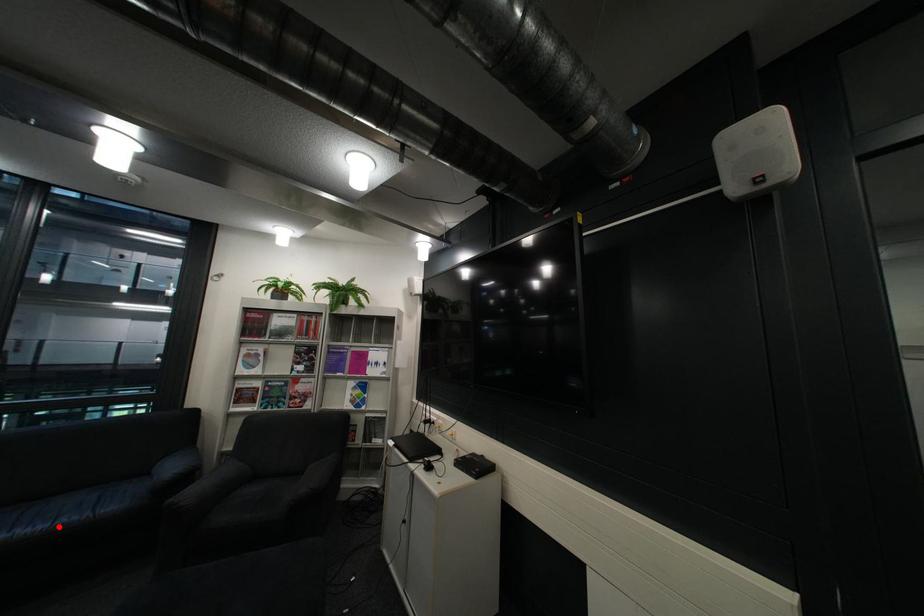
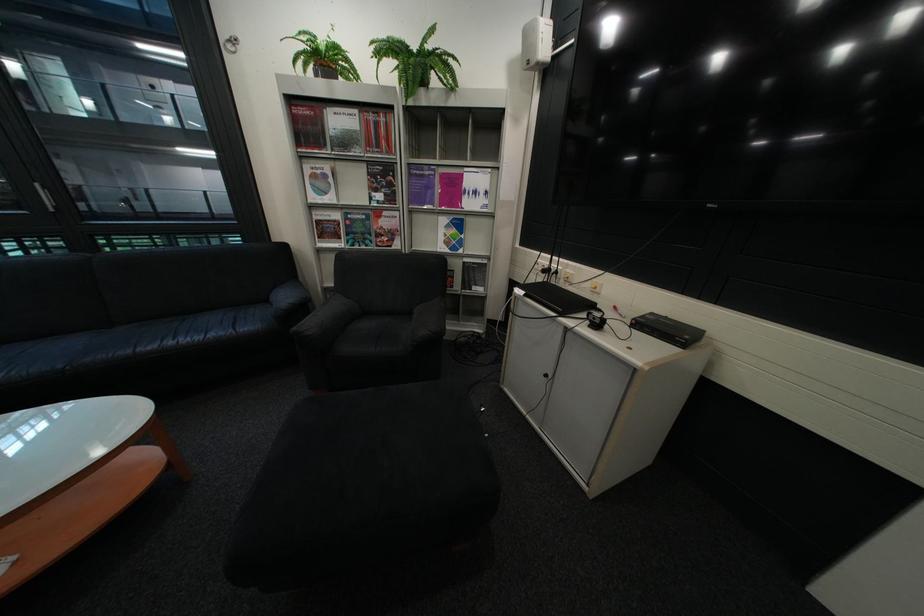
Question: I am providing you with two images of the same scene from different viewpoints. A red point is shown in image1. For the corresponding object point in image2, is it positioned nearer or farther from the camera?

Choices:
 (A) Nearer
 (B) Farther

Answer: (B)